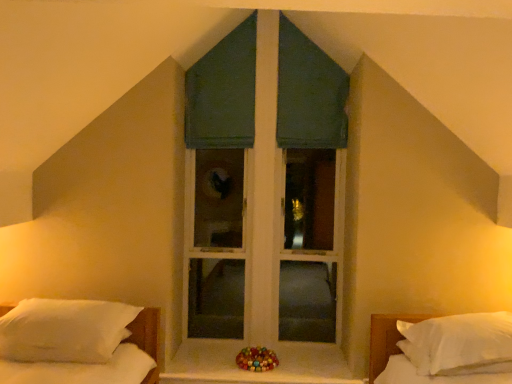
Question: Considering their positions, is green fabric window at center located in front of or behind white soft pillow at right, which is counted as the 2th bed, starting from the left?

Choices:
 (A) behind
 (B) front

Answer: (A)

Question: Looking at their shapes, would you say green fabric window at center is wider or thinner than white soft pillow at right, the 1th bed in the right-to-left sequence?

Choices:
 (A) thin
 (B) wide

Answer: (A)

Question: Estimate the real-world distances between objects in this image. Which object is farther from the white soft pillow at right, which is counted as the 2th bed, starting from the left?

Choices:
 (A) green fabric window at center
 (B) white soft pillow at left, the second bed in the right-to-left sequence
 (C) white matte window sill at center
 (D) shiny multicolored beads at center

Answer: (B)

Question: Which is nearer to the white matte window sill at center?

Choices:
 (A) green fabric window at center
 (B) white soft pillow at right, which is counted as the 2th bed, starting from the left
 (C) shiny multicolored beads at center
 (D) white soft pillow at left, the second bed in the right-to-left sequence

Answer: (C)